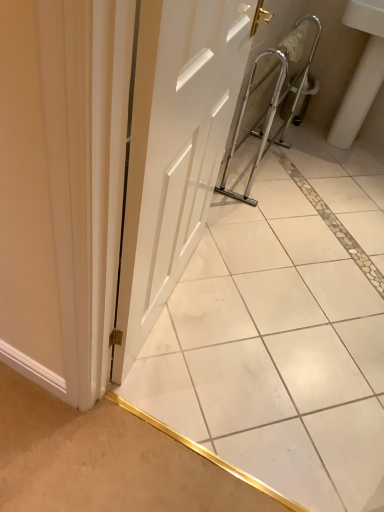
Question: From the image's perspective, relative to white matte door at center, is white ceramic sink at right above or below?

Choices:
 (A) below
 (B) above

Answer: (B)

Question: From a real-world perspective, is white ceramic sink at right above or below white matte door at center?

Choices:
 (A) above
 (B) below

Answer: (A)

Question: Estimate the real-world distances between objects in this image. Which object is closer to the white matte door at center?

Choices:
 (A) white glossy tile at center
 (B) white ceramic sink at right

Answer: (A)

Question: Based on their relative distances, which object is nearer to the white ceramic sink at right?

Choices:
 (A) white glossy tile at center
 (B) white matte door at center

Answer: (A)